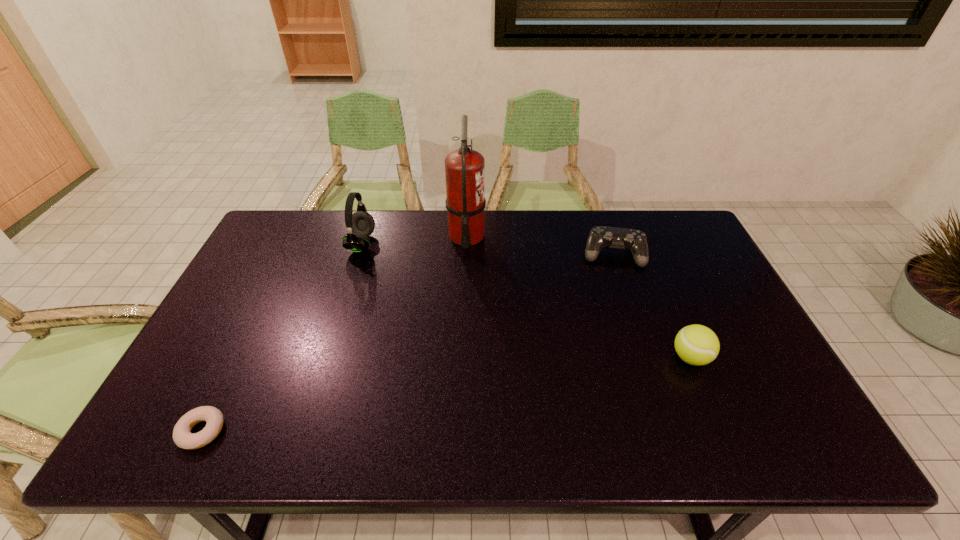
The width and height of the screenshot is (960, 540). I want to click on object positioned at the near left corner, so click(182, 436).

In the image, there is a desktop. In order to click on vacant region at the far edge in this screenshot , I will do `click(415, 226)`.

Find the location of a particular element. This screenshot has width=960, height=540. vacant space at the near edge of the desktop is located at coordinates (251, 454).

I want to click on vacant space at the left edge, so click(258, 350).

Locate an element on the screen. This screenshot has height=540, width=960. free space at the far right corner of the desktop is located at coordinates (695, 234).

Identify the location of vacant area between the second shortest object and the third tallest object. This screenshot has height=540, width=960. (652, 306).

Find the location of a particular element. Image resolution: width=960 pixels, height=540 pixels. free space between the fire extinguisher and the tennis ball is located at coordinates (578, 297).

Locate an element on the screen. The image size is (960, 540). empty space between the headset and the second shortest object is located at coordinates (488, 249).

Identify the location of free space that is in between the fourth tallest object and the tennis ball. (652, 306).

Where is `vacant space that's between the fourth tallest object and the tennis ball`? This screenshot has width=960, height=540. vacant space that's between the fourth tallest object and the tennis ball is located at coordinates (652, 306).